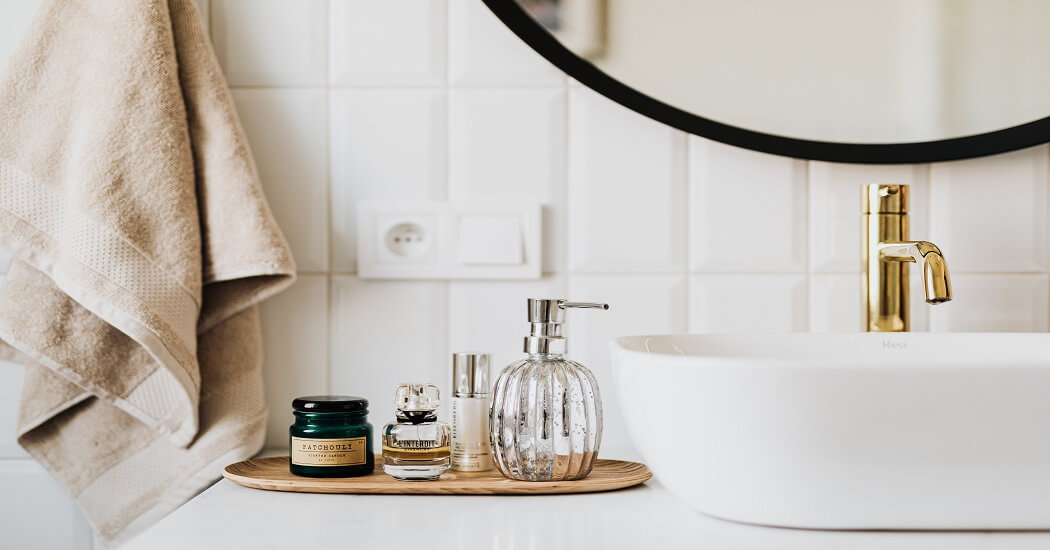
Locate an element on the screen. This screenshot has width=1050, height=550. mirror is located at coordinates (866, 63).